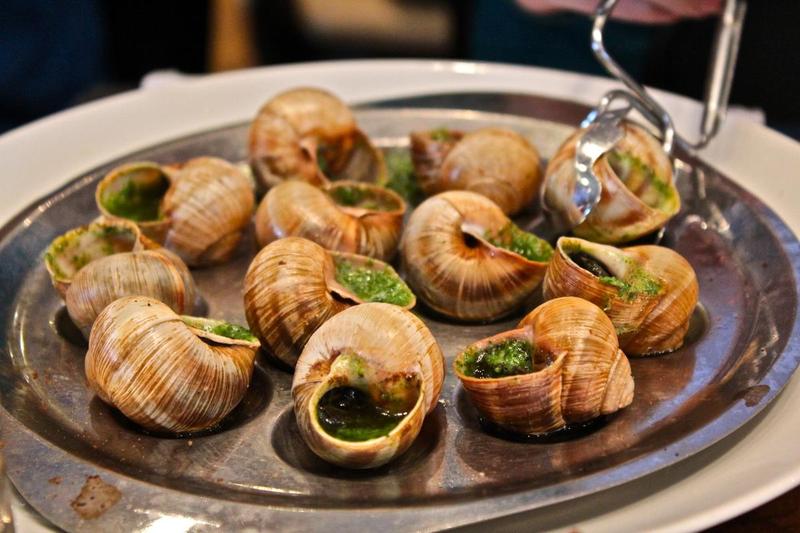
This screenshot has width=800, height=533. Identify the location of plate. (673, 379).